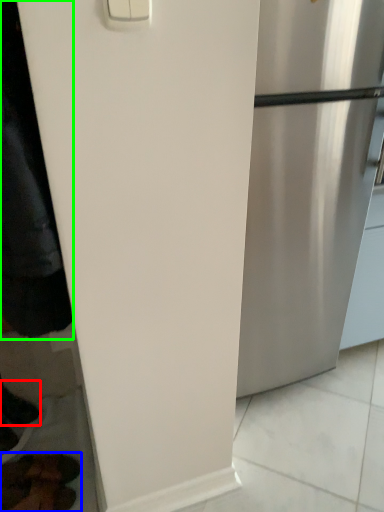
Question: Which is farther away from shoe (highlighted by a red box)? footwear (highlighted by a blue box) or jacket (highlighted by a green box)?

Choices:
 (A) footwear
 (B) jacket

Answer: (B)